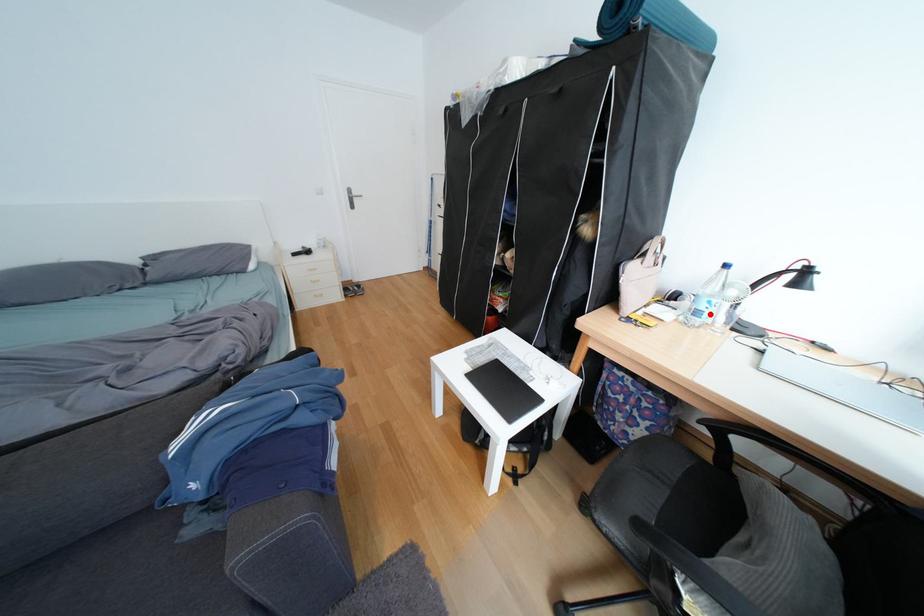
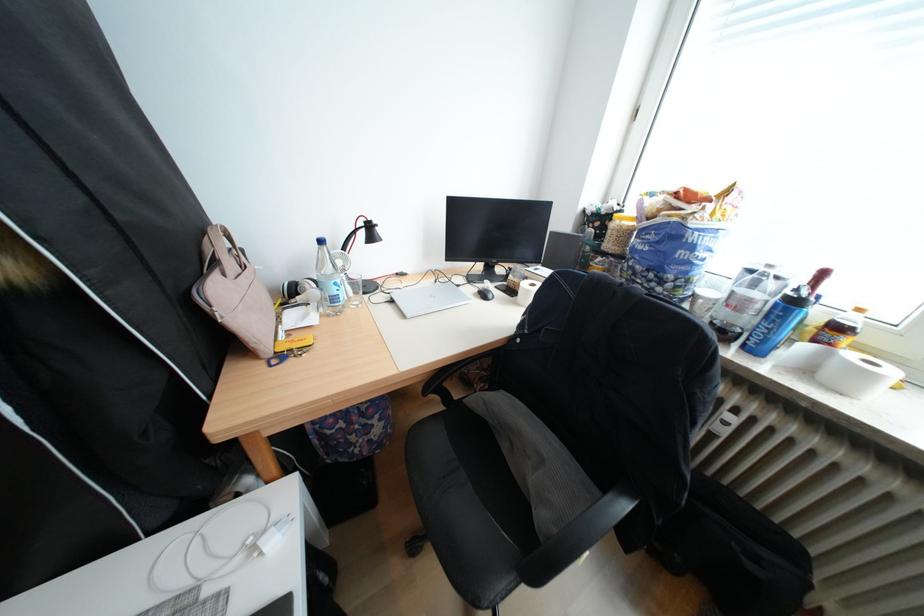
In the second image, find the point that corresponds to the highlighted location in the first image.

(346, 300)